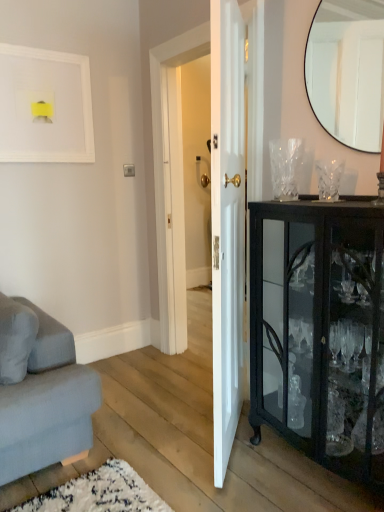
Measure the distance between white matte picture frame at upper left and camera.

white matte picture frame at upper left and camera are 8.05 feet apart.

Where is `matte black mirror at upper right`? This screenshot has width=384, height=512. matte black mirror at upper right is located at coordinates (347, 70).

Is black glass cabinet at right turned away from white matte picture frame at upper left?

No, black glass cabinet at right is not facing the opposite direction of white matte picture frame at upper left.

Which of these two, black glass cabinet at right or white matte picture frame at upper left, is bigger?

black glass cabinet at right.

From the image's perspective, does black glass cabinet at right appear higher than white matte picture frame at upper left?

Actually, black glass cabinet at right appears below white matte picture frame at upper left in the image.

Is black glass cabinet at right spatially inside white matte picture frame at upper left, or outside of it?

black glass cabinet at right is spatially situated outside white matte picture frame at upper left.

Could you tell me if white glossy door at center is turned towards white matte picture frame at upper left?

Yes, white glossy door at center is aimed at white matte picture frame at upper left.

Is the surface of white glossy door at center in direct contact with white matte picture frame at upper left?

No, white glossy door at center is not in contact with white matte picture frame at upper left.

In terms of height, does white glossy door at center look taller or shorter compared to white matte picture frame at upper left?

Clearly, white glossy door at center is taller compared to white matte picture frame at upper left.

In the scene shown: Considering the relative sizes of white matte picture frame at upper left and matte black mirror at upper right in the image provided, is white matte picture frame at upper left thinner than matte black mirror at upper right?

No, white matte picture frame at upper left is not thinner than matte black mirror at upper right.

From the image's perspective, is white matte picture frame at upper left under matte black mirror at upper right?

No, from the image's perspective, white matte picture frame at upper left is not beneath matte black mirror at upper right.

Where is `picture frame above the matte black mirror at upper right (from a real-world perspective)`? picture frame above the matte black mirror at upper right (from a real-world perspective) is located at coordinates (45, 106).

Does white matte picture frame at upper left appear on the left side of matte black mirror at upper right?

Indeed, white matte picture frame at upper left is positioned on the left side of matte black mirror at upper right.

From a real-world perspective, is white matte picture frame at upper left positioned above or below black glass cabinet at right?

white matte picture frame at upper left is above black glass cabinet at right.

Is the surface of white matte picture frame at upper left in direct contact with black glass cabinet at right?

No, white matte picture frame at upper left is not in contact with black glass cabinet at right.

Is white matte picture frame at upper left inside or outside of black glass cabinet at right?

white matte picture frame at upper left is outside black glass cabinet at right.

Is point (23, 110) positioned before point (283, 391)?

No, it is behind (283, 391).

Is matte black mirror at upper right positioned with its back to white glossy door at center?

That's not correct — matte black mirror at upper right is not looking away from white glossy door at center.

Choose the correct answer: Is matte black mirror at upper right inside white glossy door at center or outside it?

matte black mirror at upper right cannot be found inside white glossy door at center.

Measure the distance from matte black mirror at upper right to white glossy door at center.

matte black mirror at upper right is 30.00 inches away from white glossy door at center.

From a real-world perspective, who is located lower, matte black mirror at upper right or white glossy door at center?

white glossy door at center is physically lower.

Is white glossy door at center positioned beyond the bounds of matte black mirror at upper right?

white glossy door at center lies outside matte black mirror at upper right's area.

What's the angular difference between white glossy door at center and matte black mirror at upper right's facing directions?

48.9 degrees separate the facing orientations of white glossy door at center and matte black mirror at upper right.

Is the position of white glossy door at center more distant than that of matte black mirror at upper right?

No, it is not.

What's the angular difference between matte black mirror at upper right and white matte picture frame at upper left's facing directions?

The angular difference between matte black mirror at upper right and white matte picture frame at upper left is 90.2 degrees.

Where is `mirror below the white matte picture frame at upper left (from the image's perspective)`? mirror below the white matte picture frame at upper left (from the image's perspective) is located at coordinates (347, 70).

Is matte black mirror at upper right inside the boundaries of white matte picture frame at upper left, or outside?

matte black mirror at upper right is spatially situated outside white matte picture frame at upper left.

Can you confirm if matte black mirror at upper right is taller than white matte picture frame at upper left?

Indeed, matte black mirror at upper right has a greater height compared to white matte picture frame at upper left.

Identify the location of picture frame to the left of black glass cabinet at right. The width and height of the screenshot is (384, 512). tap(45, 106).

The image size is (384, 512). Identify the location of picture frame located behind the white glossy door at center. (45, 106).

Considering their positions, is white matte picture frame at upper left positioned closer to white glossy door at center than black glass cabinet at right?

Based on the image, black glass cabinet at right appears to be nearer to white glossy door at center.

Estimate the real-world distances between objects in this image. Which object is closer to white matte picture frame at upper left, black glass cabinet at right or white glossy door at center?

white glossy door at center is positioned closer to the anchor white matte picture frame at upper left.

Estimate the real-world distances between objects in this image. Which object is closer to white glossy door at center, black glass cabinet at right or white matte picture frame at upper left?

black glass cabinet at right is closer to white glossy door at center.

Looking at the image, which one is located closer to white matte picture frame at upper left, black glass cabinet at right or matte black mirror at upper right?

matte black mirror at upper right lies closer to white matte picture frame at upper left than the other object.

Which object lies further to the anchor point matte black mirror at upper right, white matte picture frame at upper left or black glass cabinet at right?

Based on the image, white matte picture frame at upper left appears to be further to matte black mirror at upper right.

Considering their positions, is white glossy door at center positioned closer to matte black mirror at upper right than white matte picture frame at upper left?

white glossy door at center is closer to matte black mirror at upper right.

When comparing their distances from black glass cabinet at right, does white glossy door at center or matte black mirror at upper right seem closer?

Based on the image, white glossy door at center appears to be nearer to black glass cabinet at right.

Estimate the real-world distances between objects in this image. Which object is further from white matte picture frame at upper left, matte black mirror at upper right or white glossy door at center?

→ matte black mirror at upper right lies further to white matte picture frame at upper left than the other object.

Identify the location of door between white matte picture frame at upper left and matte black mirror at upper right in the horizontal direction. (227, 224).

The image size is (384, 512). What are the coordinates of `door that lies between matte black mirror at upper right and black glass cabinet at right from top to bottom` in the screenshot? It's located at (227, 224).

The image size is (384, 512). What are the coordinates of `cabinetry between white matte picture frame at upper left and matte black mirror at upper right` in the screenshot? It's located at (320, 330).

At what (x,y) coordinates should I click in order to perform the action: click on door between white matte picture frame at upper left and black glass cabinet at right. Please return your answer as a coordinate pair (x, y). This screenshot has height=512, width=384. Looking at the image, I should click on (227, 224).